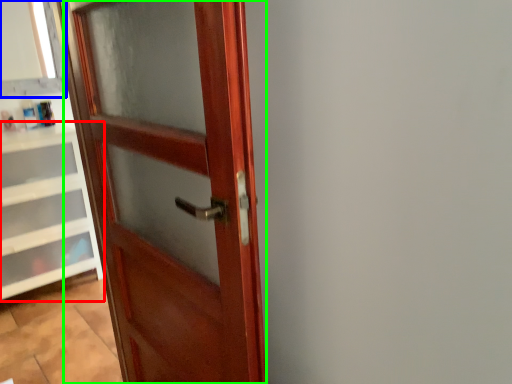
Question: Which object is positioned closest to cabinetry (highlighted by a red box)? Select from window frame (highlighted by a blue box) and door (highlighted by a green box).

Choices:
 (A) window frame
 (B) door

Answer: (A)